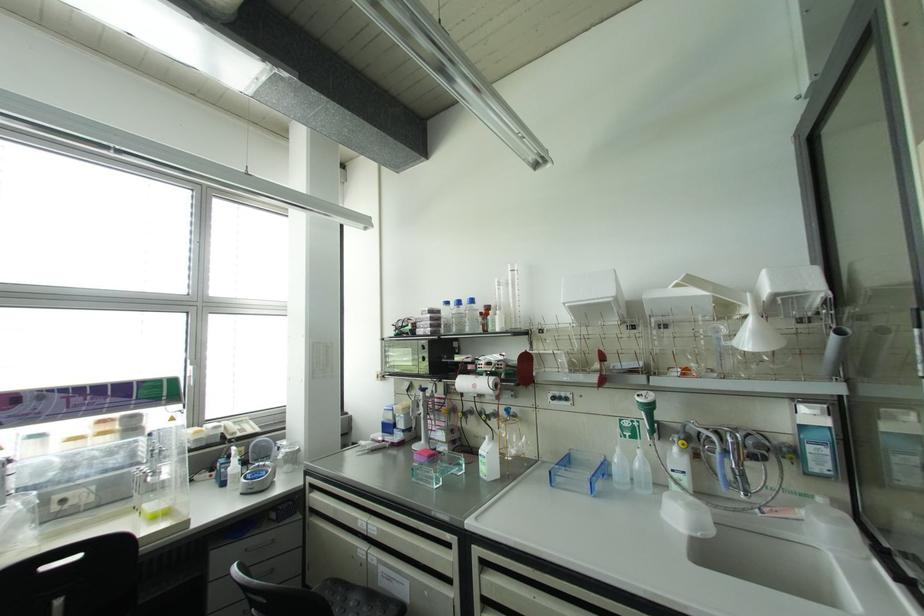
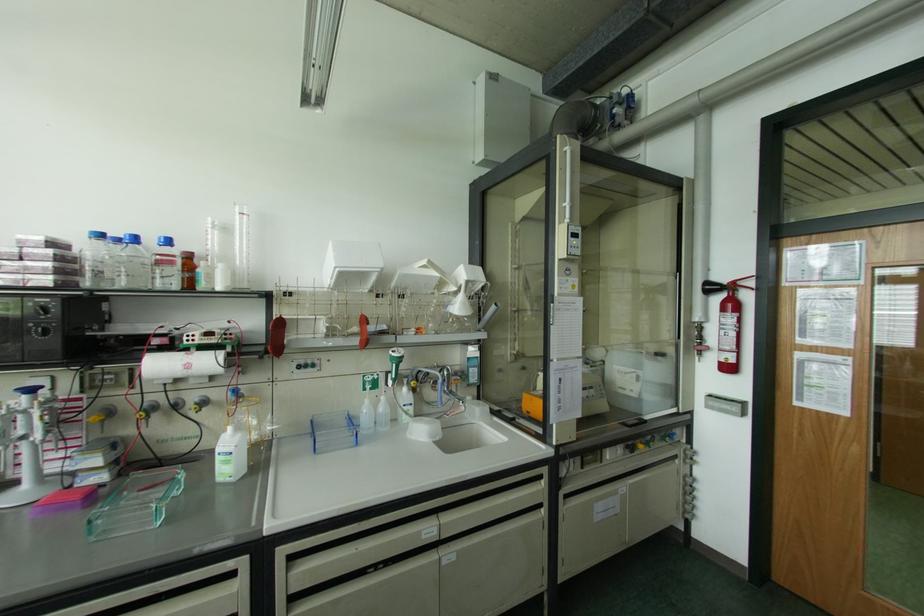
Where in the second image is the point corresponding to the point at 488,307 from the first image?

(188, 256)